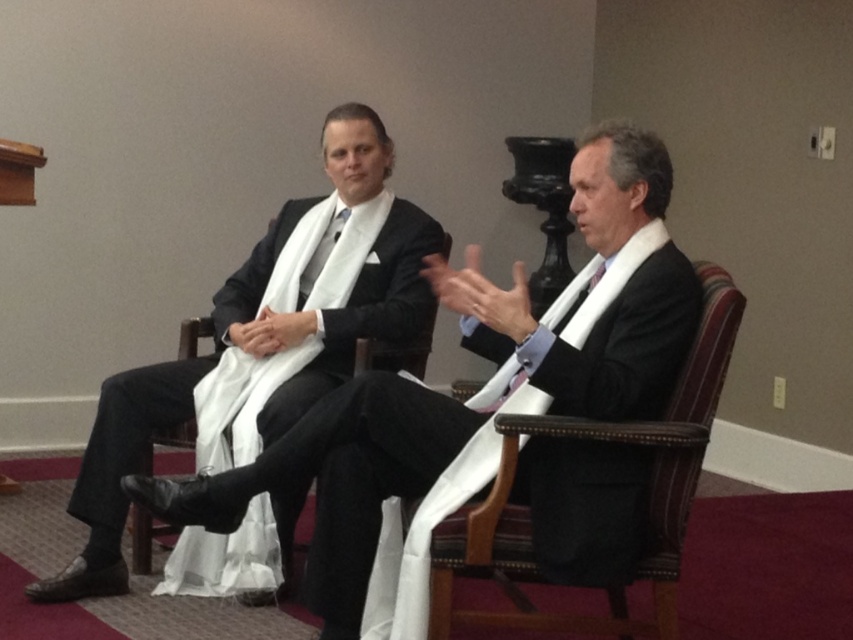
Question: Which point appears farthest from the camera in this image?

Choices:
 (A) pos(334,634)
 (B) pos(469,330)
 (C) pos(247,314)

Answer: (C)

Question: Can you confirm if matte black suit at center is wider than matte black suit at left?

Choices:
 (A) yes
 (B) no

Answer: (A)

Question: Can you confirm if matte black suit at left is positioned to the right of purple satin tie at center?

Choices:
 (A) yes
 (B) no

Answer: (B)

Question: Which point is farther to the camera?

Choices:
 (A) (675, 499)
 (B) (114, 545)

Answer: (B)

Question: Which object is positioned closest to the brown leather chair at right?

Choices:
 (A) matte black suit at center
 (B) matte black suit at left
 (C) purple satin tie at center

Answer: (A)

Question: Does matte black suit at center have a lesser width compared to brown leather chair at right?

Choices:
 (A) yes
 (B) no

Answer: (B)